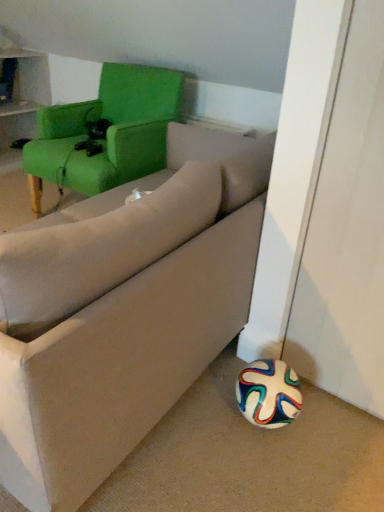
Question: From a real-world perspective, is beige fabric couch at lower right on top of beige fabric pillow at center?

Choices:
 (A) yes
 (B) no

Answer: (B)

Question: Considering the relative sizes of beige fabric couch at lower right and beige fabric pillow at center in the image provided, is beige fabric couch at lower right shorter than beige fabric pillow at center?

Choices:
 (A) no
 (B) yes

Answer: (B)

Question: Considering the relative sizes of beige fabric couch at lower right and beige fabric pillow at center in the image provided, is beige fabric couch at lower right wider than beige fabric pillow at center?

Choices:
 (A) yes
 (B) no

Answer: (A)

Question: From the image's perspective, would you say beige fabric couch at lower right is shown under beige fabric pillow at center?

Choices:
 (A) yes
 (B) no

Answer: (B)

Question: Is beige fabric couch at lower right oriented towards beige fabric pillow at center?

Choices:
 (A) no
 (B) yes

Answer: (A)

Question: Is beige fabric couch at lower right taller than beige fabric pillow at center?

Choices:
 (A) yes
 (B) no

Answer: (B)

Question: Considering the relative positions of beige fabric couch at lower right and green fabric chair at upper left in the image provided, is beige fabric couch at lower right behind green fabric chair at upper left?

Choices:
 (A) no
 (B) yes

Answer: (A)

Question: From a real-world perspective, is beige fabric couch at lower right physically above green fabric chair at upper left?

Choices:
 (A) no
 (B) yes

Answer: (A)

Question: Is green fabric chair at upper left inside beige fabric couch at lower right?

Choices:
 (A) yes
 (B) no

Answer: (B)

Question: Does beige fabric couch at lower right have a larger size compared to green fabric chair at upper left?

Choices:
 (A) no
 (B) yes

Answer: (A)

Question: Can you confirm if beige fabric couch at lower right is positioned to the right of green fabric chair at upper left?

Choices:
 (A) yes
 (B) no

Answer: (B)

Question: Is beige fabric couch at lower right thinner than green fabric chair at upper left?

Choices:
 (A) yes
 (B) no

Answer: (B)

Question: Is beige fabric pillow at center shorter than green fabric chair at upper left?

Choices:
 (A) yes
 (B) no

Answer: (A)